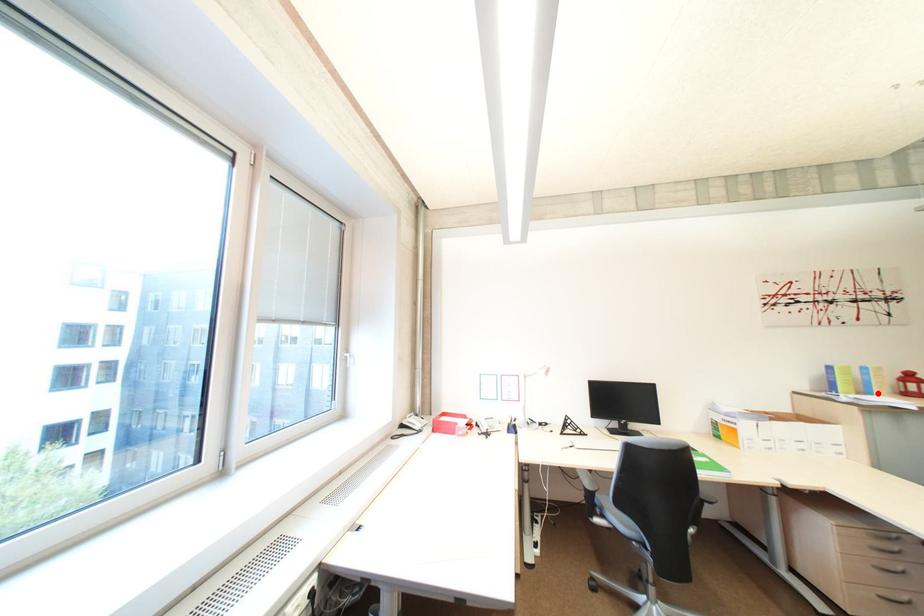
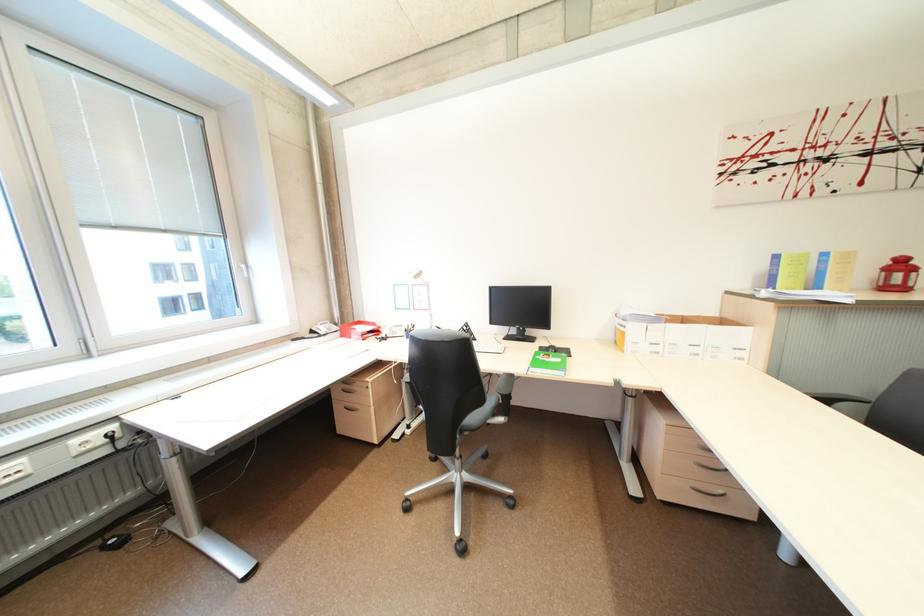
Where in the second image is the point corresponding to the highlighted location from the first image?

(825, 286)